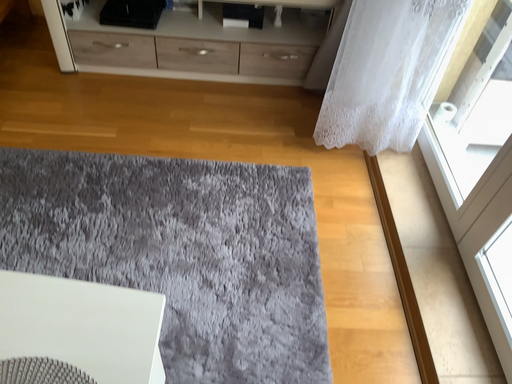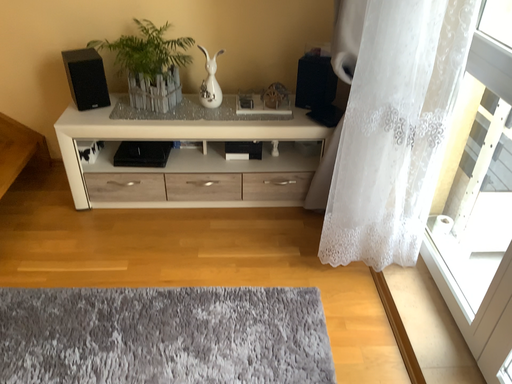
Question: How did the camera likely rotate when shooting the video?

Choices:
 (A) rotated upward
 (B) rotated downward

Answer: (A)